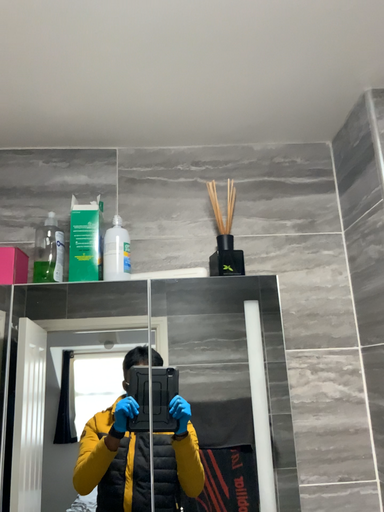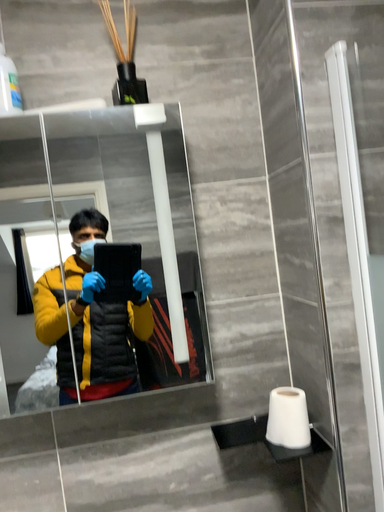
Question: How did the camera likely rotate when shooting the video?

Choices:
 (A) rotated upward
 (B) rotated downward

Answer: (B)